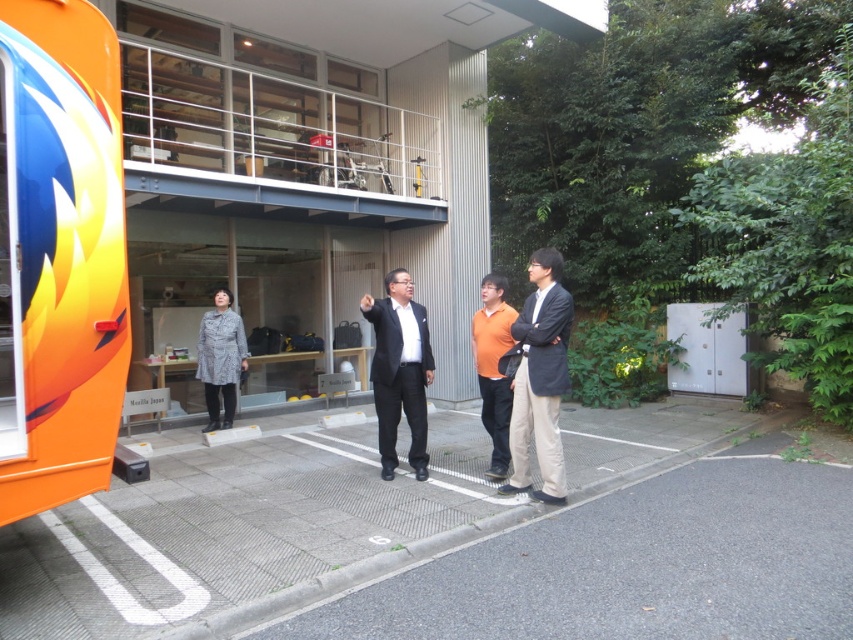
Question: Which object is the closest to the patterned fabric coat at lower left?

Choices:
 (A) black suit at center
 (B) orange glossy tour bus at left
 (C) orange matte shirt at center
 (D) dark gray suit at center

Answer: (A)

Question: Among these objects, which one is nearest to the camera?

Choices:
 (A) orange matte shirt at center
 (B) patterned fabric coat at lower left

Answer: (A)

Question: Which point is farther to the camera?

Choices:
 (A) patterned fabric coat at lower left
 (B) orange matte shirt at center

Answer: (A)

Question: Does orange glossy tour bus at left have a greater width compared to black suit at center?

Choices:
 (A) no
 (B) yes

Answer: (B)

Question: Can you confirm if orange glossy tour bus at left is bigger than patterned fabric coat at lower left?

Choices:
 (A) no
 (B) yes

Answer: (B)

Question: Does black suit at center have a smaller size compared to patterned fabric coat at lower left?

Choices:
 (A) yes
 (B) no

Answer: (B)